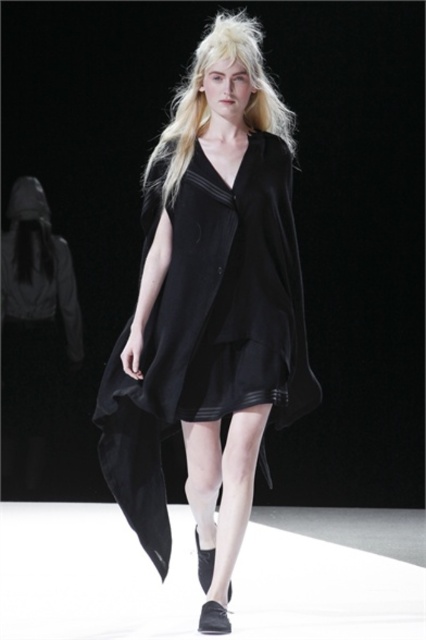
Is black matte dress at center taller than blonde silky hair at center?

Indeed, black matte dress at center has a greater height compared to blonde silky hair at center.

Describe the element at coordinates (210, 310) in the screenshot. This screenshot has height=640, width=426. I see `black matte dress at center` at that location.

Where is `black matte dress at center`? The image size is (426, 640). black matte dress at center is located at coordinates (210, 310).